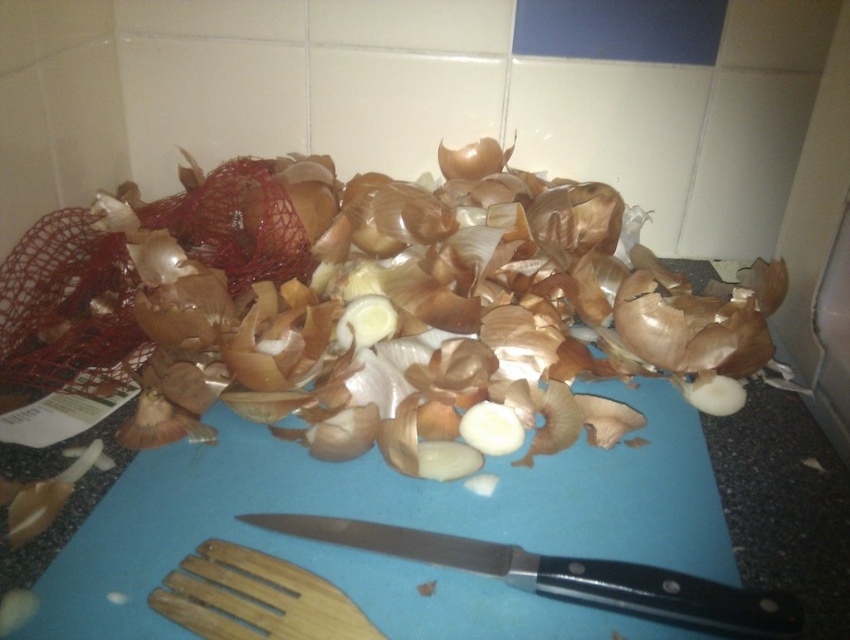
You are a chef standing in front of the kitchen counter. You need to reach the blue plastic cutting board at center to continue chopping. Considering your arm can comfortably reach up to 70 centimeters, can you comfortably reach the cutting board?

The blue plastic cutting board at center is 38.24 centimeters away from the viewer. Since your arm can reach up to 70 centimeters, you can comfortably reach it.

From the picture: You are standing at the kitchen counter and want to place a new spice jar on the counter. The spice jar is 10 cm in diameter. The point marked at (398, 524) is the center of the blue plastic cutting board at center. Is there enough space on the counter next to the blue plastic cutting board at center to place the spice jar without overlapping it?

The point marked at (398, 524) is the center of the blue plastic cutting board at center. Since the spice jar is 10 cm in diameter, there is sufficient space on the counter next to the blue plastic cutting board at center to place it without overlapping, provided the counter has enough clearance around the cutting board.

You are standing in front of the kitchen counter. Where is the blue plastic cutting board at center located in terms of coordinates?

The blue plastic cutting board at center is located at coordinates point [398,524].